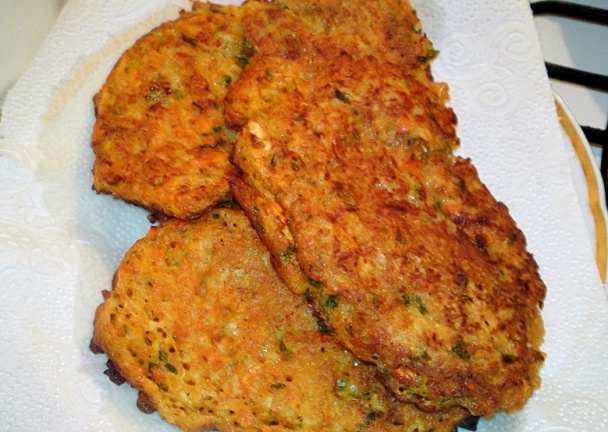
At what (x,y) coordinates should I click in order to perform the action: click on white paper towel. Please return your answer as a coordinate pair (x, y). Looking at the image, I should click on (586, 411).